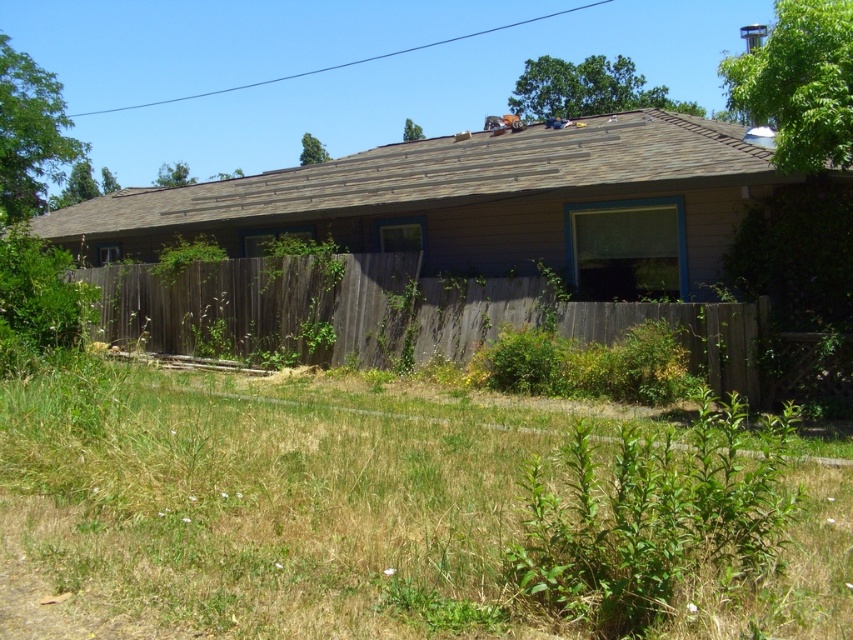
Question: Where is green grass at lower center located in relation to brown wood house at center in the image?

Choices:
 (A) above
 (B) below

Answer: (B)

Question: Estimate the real-world distances between objects in this image. Which object is farther from the green grass at lower center?

Choices:
 (A) weathered wood fence at center
 (B) brown wood house at center
 (C) green leafy plant at lower right

Answer: (B)

Question: Which is farther from the green grass at lower center?

Choices:
 (A) weathered wood fence at center
 (B) green leafy plant at lower right
 (C) brown wood house at center

Answer: (C)

Question: Among these points, which one is nearest to the camera?

Choices:
 (A) (712, 500)
 (B) (444, 349)

Answer: (A)

Question: Can you confirm if brown wood house at center is smaller than weathered wood fence at center?

Choices:
 (A) yes
 (B) no

Answer: (B)

Question: In this image, where is weathered wood fence at center located relative to green leafy plant at lower right?

Choices:
 (A) left
 (B) right

Answer: (A)